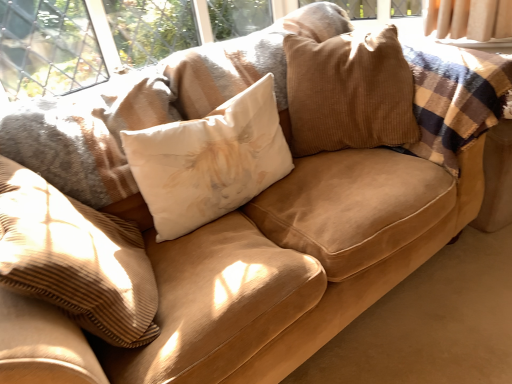
What is the approximate height of corduroy pillow at center, which is the 3th pillow in left-to-right order?

21.73 inches.

What do you see at coordinates (75, 259) in the screenshot? I see `white corduroy pillow at center, acting as the third pillow starting from the right` at bounding box center [75, 259].

Locate an element on the screen. corduroy pillow at center, which ranks as the first pillow in right-to-left order is located at coordinates (349, 92).

From the image's perspective, which one is positioned higher, white cotton pillow at center, positioned as the second pillow in right-to-left order, or white corduroy pillow at center, acting as the third pillow starting from the right?

white cotton pillow at center, positioned as the second pillow in right-to-left order, is shown above in the image.

Are white cotton pillow at center, positioned as the second pillow in right-to-left order, and white corduroy pillow at center, acting as the third pillow starting from the right, far apart?

white cotton pillow at center, positioned as the second pillow in right-to-left order, is actually quite close to white corduroy pillow at center, acting as the third pillow starting from the right.

Would you say white cotton pillow at center, positioned as the second pillow in right-to-left order, is inside or outside white corduroy pillow at center, acting as the third pillow starting from the right?

The correct answer is: outside.

Is white cotton pillow at center, positioned as the second pillow in right-to-left order, bigger or smaller than corduroy pillow at center, which ranks as the first pillow in right-to-left order?

In the image, white cotton pillow at center, positioned as the second pillow in right-to-left order, appears to be smaller than corduroy pillow at center, which ranks as the first pillow in right-to-left order.

From a real-world perspective, between white cotton pillow at center, which is counted as the second pillow, starting from the left, and corduroy pillow at center, which is the 3th pillow in left-to-right order, who is vertically higher?

corduroy pillow at center, which is the 3th pillow in left-to-right order, from a real-world perspective.

Can you confirm if white cotton pillow at center, positioned as the second pillow in right-to-left order, is positioned to the right of corduroy pillow at center, which ranks as the first pillow in right-to-left order?

Incorrect, white cotton pillow at center, positioned as the second pillow in right-to-left order, is not on the right side of corduroy pillow at center, which ranks as the first pillow in right-to-left order.

From the image's perspective, is white cotton pillow at center, positioned as the second pillow in right-to-left order, beneath corduroy pillow at center, which ranks as the first pillow in right-to-left order?

Yes, from the image's perspective, white cotton pillow at center, positioned as the second pillow in right-to-left order, is beneath corduroy pillow at center, which ranks as the first pillow in right-to-left order.

Considering the points (105, 276) and (377, 129), which point is behind, point (105, 276) or point (377, 129)?

The point (377, 129) is farther from the camera.

In the image, is white corduroy pillow at center, the 1th pillow in the left-to-right sequence, on the left side or the right side of corduroy pillow at center, which is the 3th pillow in left-to-right order?

From the image, it's evident that white corduroy pillow at center, the 1th pillow in the left-to-right sequence, is to the left of corduroy pillow at center, which is the 3th pillow in left-to-right order.

Between white corduroy pillow at center, the 1th pillow in the left-to-right sequence, and corduroy pillow at center, which ranks as the first pillow in right-to-left order, which one has smaller size?

white corduroy pillow at center, the 1th pillow in the left-to-right sequence.

You are a GUI agent. You are given a task and a screenshot of the screen. Output one action in this format:
    pyautogui.click(x=<x>, y=<y>)
    Task: Click on the 2nd pillow behind the white corduroy pillow at center, acting as the third pillow starting from the right
    The height and width of the screenshot is (384, 512).
    Given the screenshot: What is the action you would take?
    pyautogui.click(x=349, y=92)

Which object is further away from the camera taking this photo, corduroy pillow at center, which is the 3th pillow in left-to-right order, or white corduroy pillow at center, the 1th pillow in the left-to-right sequence?

corduroy pillow at center, which is the 3th pillow in left-to-right order, is more distant.

Is corduroy pillow at center, which is the 3th pillow in left-to-right order, beside white corduroy pillow at center, acting as the third pillow starting from the right?

corduroy pillow at center, which is the 3th pillow in left-to-right order, and white corduroy pillow at center, acting as the third pillow starting from the right, are not in contact.

Would you say white corduroy pillow at center, the 1th pillow in the left-to-right sequence, is part of corduroy pillow at center, which is the 3th pillow in left-to-right order,'s contents?

Definitely not — white corduroy pillow at center, the 1th pillow in the left-to-right sequence, is not inside corduroy pillow at center, which is the 3th pillow in left-to-right order.

Is point (348, 58) closer or farther from the camera than point (42, 248)?

Point (348, 58) is farther from the camera than point (42, 248).

From a real-world perspective, which pillow is the 1st one above the white cotton pillow at center, which is counted as the second pillow, starting from the left? Please provide its 2D coordinates.

[(75, 259)]

Is white cotton pillow at center, which is counted as the second pillow, starting from the left, surrounded by white corduroy pillow at center, the 1th pillow in the left-to-right sequence?

No.

Is white corduroy pillow at center, acting as the third pillow starting from the right, taller or shorter than white cotton pillow at center, which is counted as the second pillow, starting from the left?

Considering their sizes, white corduroy pillow at center, acting as the third pillow starting from the right, has more height than white cotton pillow at center, which is counted as the second pillow, starting from the left.

From a real-world perspective, is white corduroy pillow at center, acting as the third pillow starting from the right, located higher than white cotton pillow at center, which is counted as the second pillow, starting from the left?

Yes, from a real-world perspective, white corduroy pillow at center, acting as the third pillow starting from the right, is above white cotton pillow at center, which is counted as the second pillow, starting from the left.

Is corduroy pillow at center, which is the 3th pillow in left-to-right order, shorter than white cotton pillow at center, which is counted as the second pillow, starting from the left?

No, corduroy pillow at center, which is the 3th pillow in left-to-right order, is not shorter than white cotton pillow at center, which is counted as the second pillow, starting from the left.

Considering the positions of objects corduroy pillow at center, which is the 3th pillow in left-to-right order, and white cotton pillow at center, which is counted as the second pillow, starting from the left, in the image provided, who is more to the right, corduroy pillow at center, which is the 3th pillow in left-to-right order, or white cotton pillow at center, which is counted as the second pillow, starting from the left,?

corduroy pillow at center, which is the 3th pillow in left-to-right order.

Considering the positions of objects corduroy pillow at center, which ranks as the first pillow in right-to-left order, and white cotton pillow at center, positioned as the second pillow in right-to-left order, in the image provided, who is in front, corduroy pillow at center, which ranks as the first pillow in right-to-left order, or white cotton pillow at center, positioned as the second pillow in right-to-left order,?

Positioned in front is white cotton pillow at center, positioned as the second pillow in right-to-left order.

From a real-world perspective, is corduroy pillow at center, which is the 3th pillow in left-to-right order, positioned above or below white cotton pillow at center, positioned as the second pillow in right-to-left order?

corduroy pillow at center, which is the 3th pillow in left-to-right order, is above white cotton pillow at center, positioned as the second pillow in right-to-left order.

This screenshot has height=384, width=512. Identify the location of the 1st pillow positioned above the white cotton pillow at center, positioned as the second pillow in right-to-left order (from a real-world perspective). (75, 259).

Locate an element on the screen. This screenshot has width=512, height=384. pillow lying on the right of white cotton pillow at center, positioned as the second pillow in right-to-left order is located at coordinates (349, 92).

Consider the image. Looking at the image, which one is located further to white corduroy pillow at center, the 1th pillow in the left-to-right sequence, white cotton pillow at center, which is counted as the second pillow, starting from the left, or corduroy pillow at center, which is the 3th pillow in left-to-right order?

Among the two, corduroy pillow at center, which is the 3th pillow in left-to-right order, is located further to white corduroy pillow at center, the 1th pillow in the left-to-right sequence.

When comparing their distances from white corduroy pillow at center, the 1th pillow in the left-to-right sequence, does corduroy pillow at center, which ranks as the first pillow in right-to-left order, or white cotton pillow at center, positioned as the second pillow in right-to-left order, seem further?

corduroy pillow at center, which ranks as the first pillow in right-to-left order, is further to white corduroy pillow at center, the 1th pillow in the left-to-right sequence.

Estimate the real-world distances between objects in this image. Which object is further from corduroy pillow at center, which ranks as the first pillow in right-to-left order, white cotton pillow at center, positioned as the second pillow in right-to-left order, or white corduroy pillow at center, acting as the third pillow starting from the right?

white corduroy pillow at center, acting as the third pillow starting from the right.

Based on their spatial positions, is white corduroy pillow at center, acting as the third pillow starting from the right, or white cotton pillow at center, positioned as the second pillow in right-to-left order, closer to corduroy pillow at center, which ranks as the first pillow in right-to-left order?

Among the two, white cotton pillow at center, positioned as the second pillow in right-to-left order, is located nearer to corduroy pillow at center, which ranks as the first pillow in right-to-left order.

Which object lies further to the anchor point white cotton pillow at center, which is counted as the second pillow, starting from the left, corduroy pillow at center, which ranks as the first pillow in right-to-left order, or white corduroy pillow at center, acting as the third pillow starting from the right?

The object further to white cotton pillow at center, which is counted as the second pillow, starting from the left, is white corduroy pillow at center, acting as the third pillow starting from the right.

When comparing their distances from white cotton pillow at center, which is counted as the second pillow, starting from the left, does white corduroy pillow at center, the 1th pillow in the left-to-right sequence, or corduroy pillow at center, which is the 3th pillow in left-to-right order, seem closer?

Among the two, corduroy pillow at center, which is the 3th pillow in left-to-right order, is located nearer to white cotton pillow at center, which is counted as the second pillow, starting from the left.

The height and width of the screenshot is (384, 512). I want to click on pillow between white corduroy pillow at center, acting as the third pillow starting from the right, and corduroy pillow at center, which ranks as the first pillow in right-to-left order, in the horizontal direction, so click(x=209, y=161).